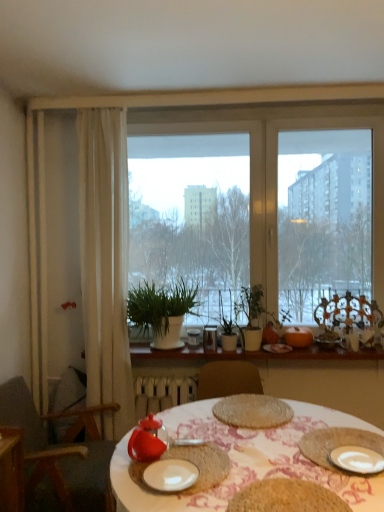
I want to click on free space to the left of white matte plate at center, the first plate when ordered from left to right, so click(x=130, y=481).